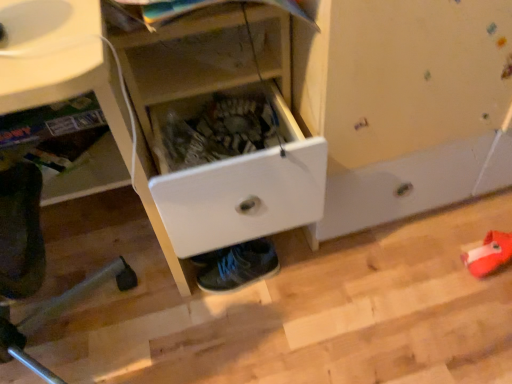
The width and height of the screenshot is (512, 384). Find the location of `free space in front of white plastic drawer at center`. free space in front of white plastic drawer at center is located at coordinates (261, 335).